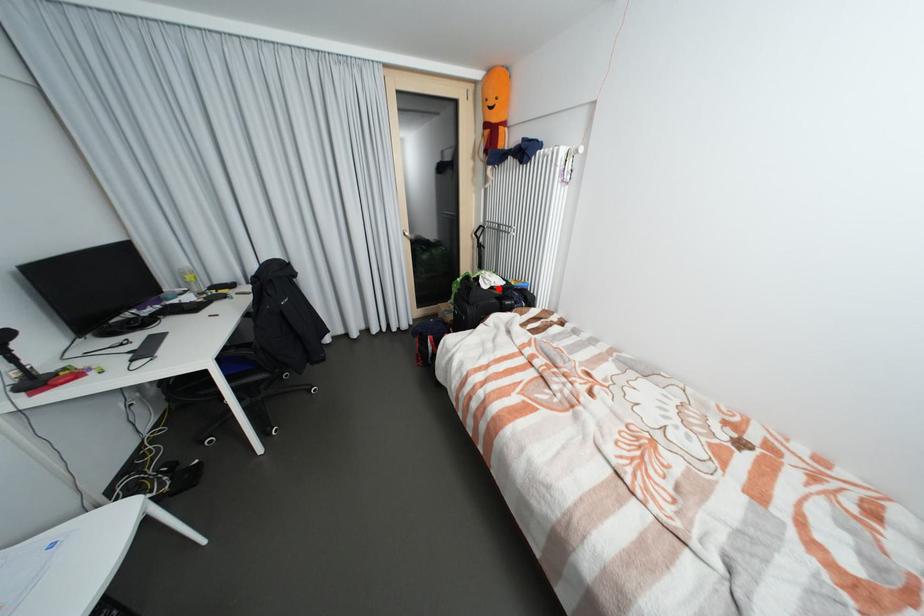
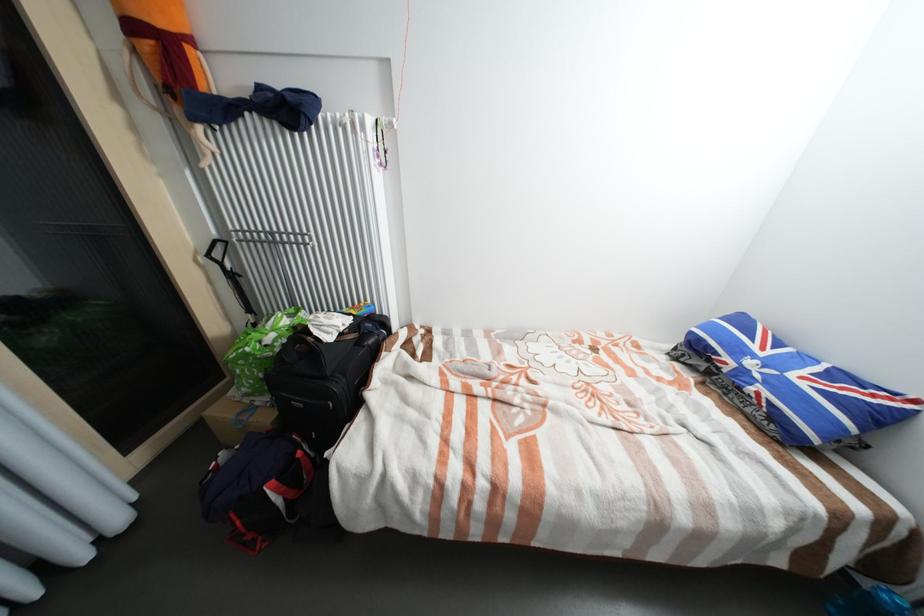
Question: I am providing you with two images of the same scene from different viewpoints. A red point is shown in image1. For the corresponding object point in image2, is it positioned nearer or farther from the camera?

Choices:
 (A) Nearer
 (B) Farther

Answer: (A)